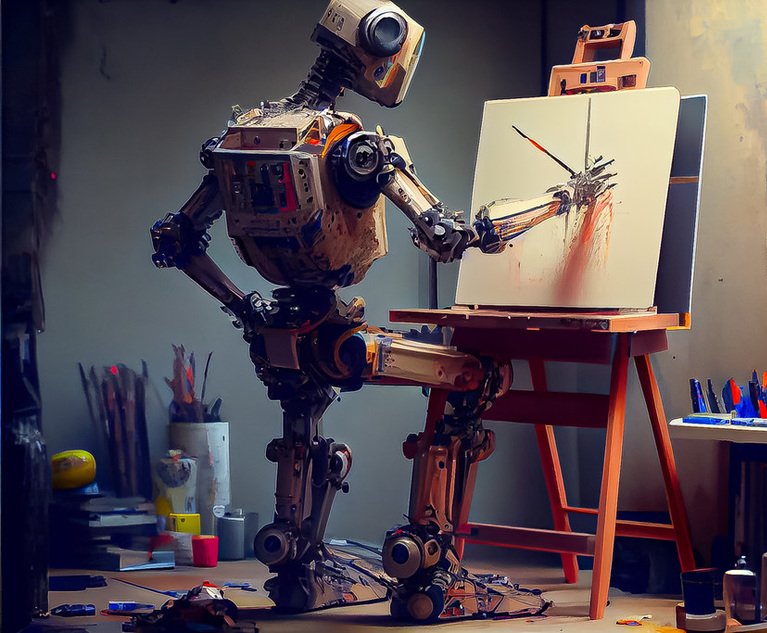
Image resolution: width=767 pixels, height=633 pixels. Find the location of `white canvas`. white canvas is located at coordinates (642, 132).